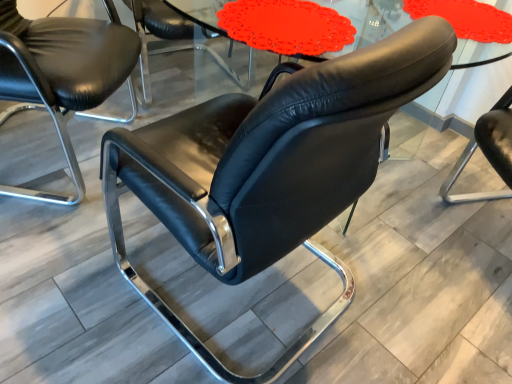
This screenshot has height=384, width=512. I want to click on blank area beneath black leather chair at center, the third chair in the front-to-back sequence (from a real-world perspective), so click(x=169, y=75).